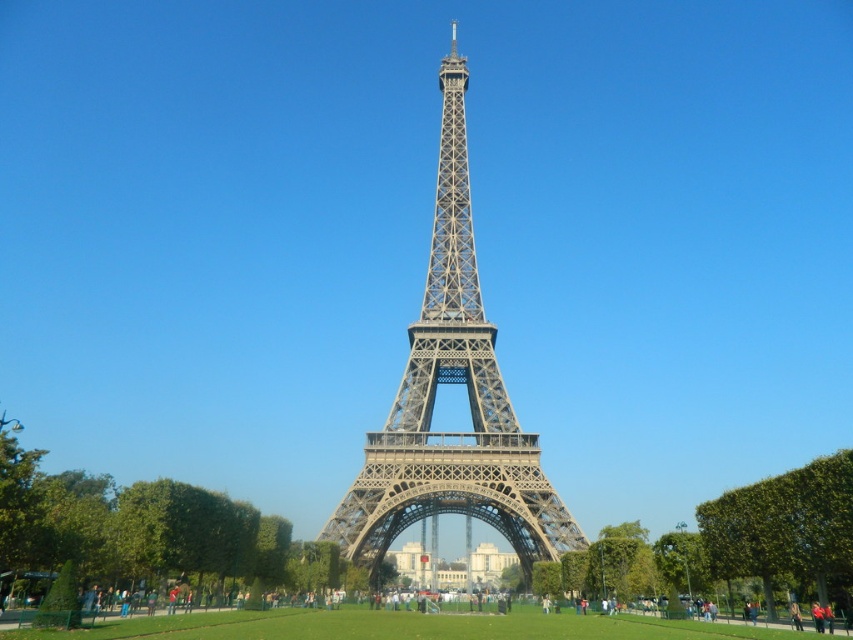
You are a tourist standing at the base of the Eiffel Tower and want to take a photo that includes both the green leafy tree at lower left and the green leafy tree at center. Which tree should you position closer to the camera to ensure both are in the frame?

The green leafy tree at lower left should be positioned closer to the camera because the green leafy tree at center is behind it, so moving closer to the lower left tree will keep both visible in the frame.

You are standing in front of the Eiffel Tower and want to take a photo that includes both the green leafy tree at lower left and the green leafy tree at center. Which tree should you position closer to the left side of your camera frame to include both in the photo?

You should position the green leafy tree at lower left closer to the left side of your camera frame since it is already to the left of the green leafy tree at center, allowing both trees to fit within the photo.